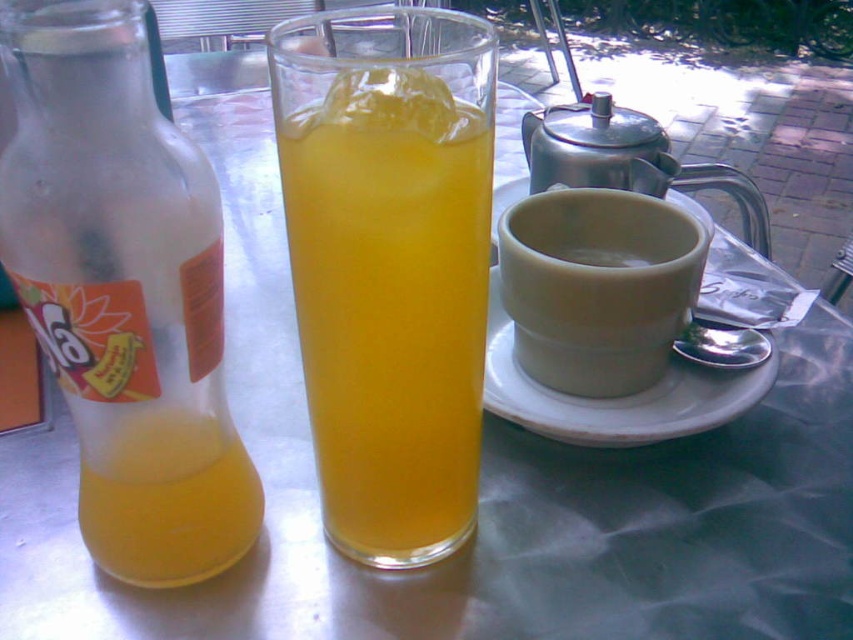
You are at a cafe table and want to pour the contents of the translucent glass bottle at left into the translucent glass at center. Will the glass at center be able to hold all the liquid from the bottle without overflowing?

The translucent glass at center has a larger size compared to the translucent glass bottle at left, so yes, the glass at center can hold all the liquid from the bottle without overflowing.

You are standing at the table and want to reach a point that is exactly 10 inches away from you. Is the point at coordinates point (x=450, y=452) within that range?

The distance of point (x=450, y=452) from viewer is 10.38 inches, so the point is slightly beyond the 10 inches range.